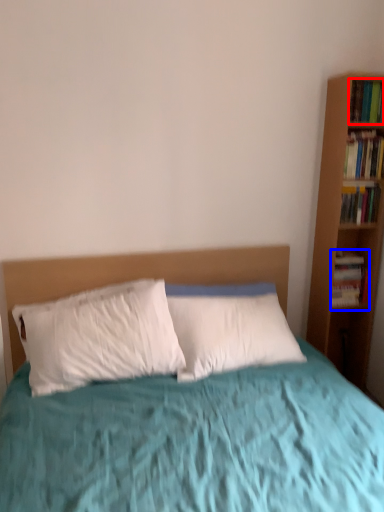
Question: Which of the following is the farthest to the observer, book (highlighted by a red box) or book (highlighted by a blue box)?

Choices:
 (A) book
 (B) book

Answer: (B)